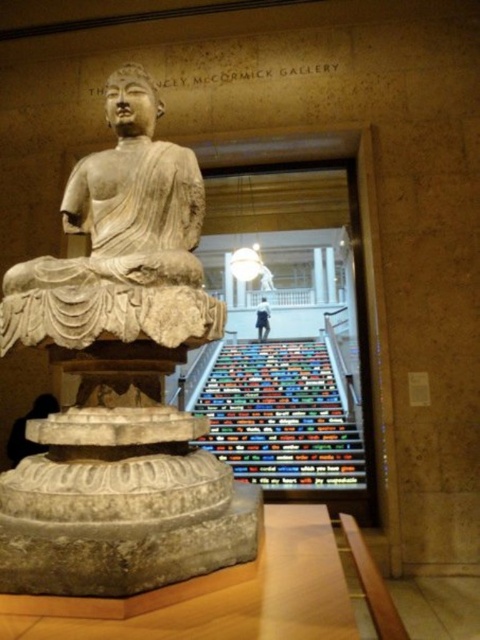
Who is higher up, stone statue at center or beige stone statue at center?

beige stone statue at center is higher up.

Is stone statue at center positioned behind beige stone statue at center?

No, it is not.

The image size is (480, 640). In order to click on stone statue at center in this screenshot , I will do `click(120, 380)`.

Can you confirm if beige stone statue at center is positioned above multicolored carpeted stairs at center?

Indeed, beige stone statue at center is positioned over multicolored carpeted stairs at center.

Does beige stone statue at center come in front of multicolored carpeted stairs at center?

That is True.

Which is behind, point (169, 333) or point (253, 440)?

Positioned behind is point (253, 440).

Where is `beige stone statue at center`? The image size is (480, 640). beige stone statue at center is located at coordinates (121, 243).

Who is higher up, stone statue at center or multicolored carpeted stairs at center?

stone statue at center is higher up.

Who is more forward, (49,269) or (288,419)?

Point (49,269)

At what (x,y) coordinates should I click in order to perform the action: click on stone statue at center. Please return your answer as a coordinate pair (x, y). Looking at the image, I should click on (120, 380).